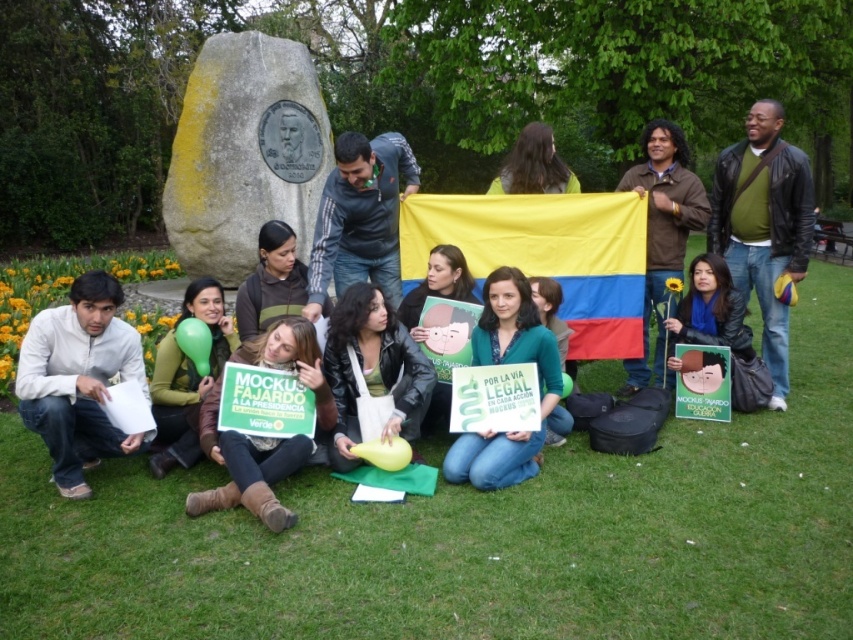
Question: Which point appears closest to the camera in this image?

Choices:
 (A) (213, 410)
 (B) (540, 248)

Answer: (A)

Question: Can you confirm if yellow fabric flag at center is thinner than leather jacket at center?

Choices:
 (A) no
 (B) yes

Answer: (A)

Question: Is green grass at lower center below green fabric sign at lower center?

Choices:
 (A) no
 (B) yes

Answer: (B)

Question: Which object is farther from the camera taking this photo?

Choices:
 (A) green grass at lower center
 (B) matte yellow shirt at upper center
 (C) leather jacket at center
 (D) yellow fabric flag at center

Answer: (B)

Question: Does green grass at lower center have a lesser width compared to white matte shirt at lower left?

Choices:
 (A) no
 (B) yes

Answer: (A)

Question: Which object appears farthest from the camera in this image?

Choices:
 (A) matte yellow shirt at upper center
 (B) white matte shirt at lower left
 (C) green grass at lower center
 (D) yellow fabric flag at center

Answer: (A)